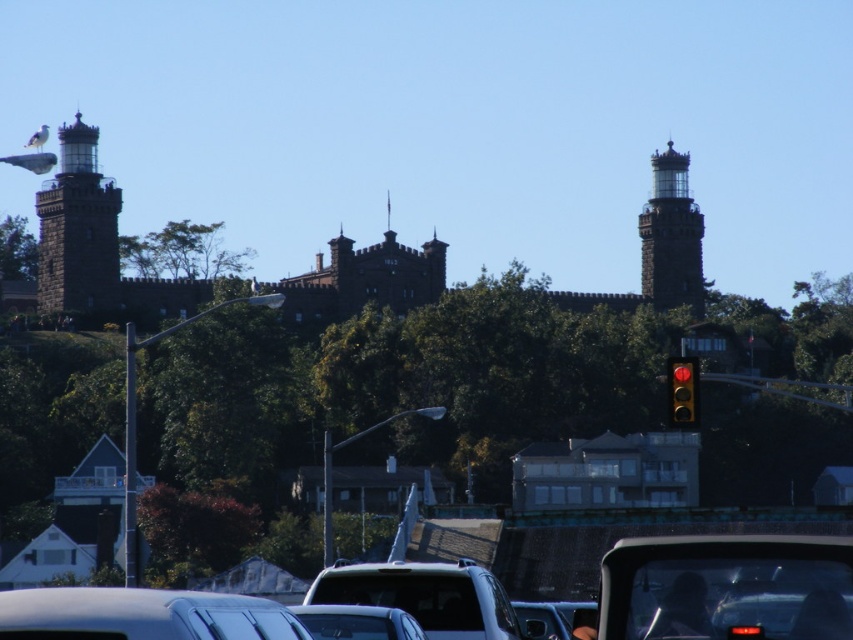
Imagine you are standing at the base of the historic castle and looking towards the castle structure. There are two points marked on the castle walls, one at coordinate point (44, 616) and the other at point (683, 372). Which of these two points is nearer to your current position?

Point (44, 616) is closer to the viewer than point (683, 372), so the point at coordinate point (44, 616) is nearer to your current position.

You are a tour guide explaining the distance between the satin black suv at center and the dark gray stone tower at upper right to a visitor. What do you tell them?

The satin black suv at center and the dark gray stone tower at upper right are 77.94 meters apart.

You are driving a satin black suv at center and want to park under the dark gray stone tower at upper right. Is your current position already under the tower?

The satin black suv at center is below dark gray stone tower at upper right, so yes, it is already parked under the tower.